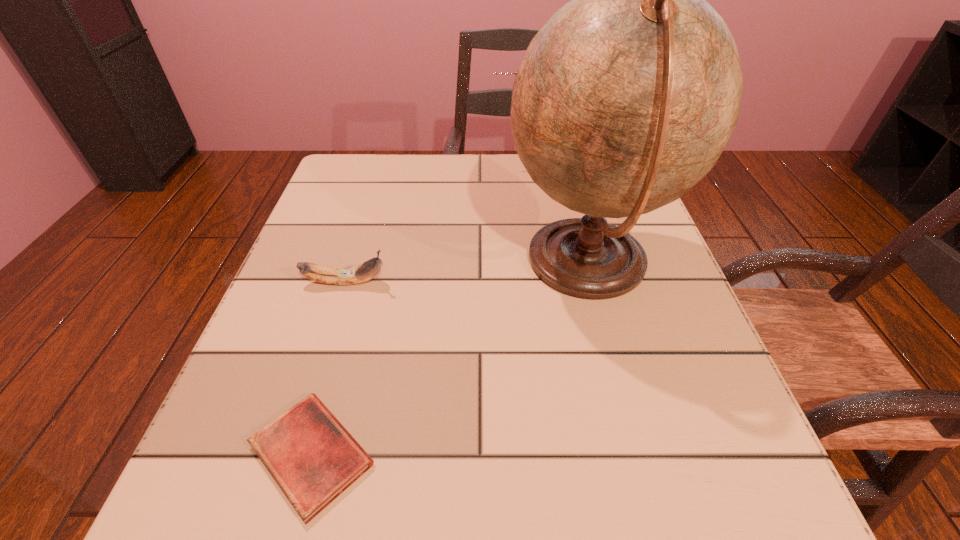
Where is `vacant space located 0.120m on the handle side of the farthest object`? This screenshot has height=540, width=960. vacant space located 0.120m on the handle side of the farthest object is located at coordinates (443, 164).

Identify the location of vacant region located on the handle side of the farthest object. The width and height of the screenshot is (960, 540). (395, 164).

Locate an element on the screen. free spot located at the stem of the banana is located at coordinates (542, 282).

Image resolution: width=960 pixels, height=540 pixels. I want to click on blank space located on the back of the diary, so click(x=361, y=276).

Locate an element on the screen. The width and height of the screenshot is (960, 540). object at the far edge is located at coordinates pyautogui.click(x=515, y=73).

Find the location of a particular element. Image resolution: width=960 pixels, height=540 pixels. object at the near edge is located at coordinates (311, 456).

At what (x,y) coordinates should I click in order to perform the action: click on banana that is at the left edge. Please return your answer as a coordinate pair (x, y). The height and width of the screenshot is (540, 960). Looking at the image, I should click on (360, 273).

Locate an element on the screen. The image size is (960, 540). diary located at the left edge is located at coordinates (311, 456).

This screenshot has height=540, width=960. What are the coordinates of `globe at the right edge` in the screenshot? It's located at (625, 99).

At what (x,y) coordinates should I click in order to perform the action: click on drill that is at the right edge. Please return your answer as a coordinate pair (x, y). This screenshot has height=540, width=960. Looking at the image, I should click on pos(515,73).